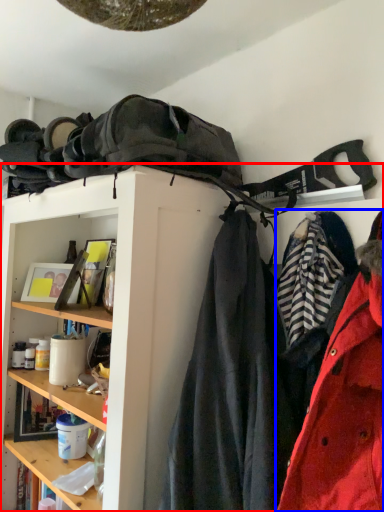
Question: Which object appears closest to the camera in this image, shelf (highlighted by a red box) or coat (highlighted by a blue box)?

Choices:
 (A) shelf
 (B) coat

Answer: (A)